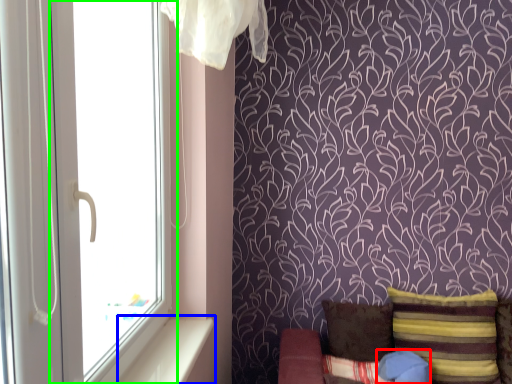
Question: Which object is the farthest from pillow (highlighted by a red box)? Choose among these: window sill (highlighted by a blue box) or window (highlighted by a green box).

Choices:
 (A) window sill
 (B) window

Answer: (B)